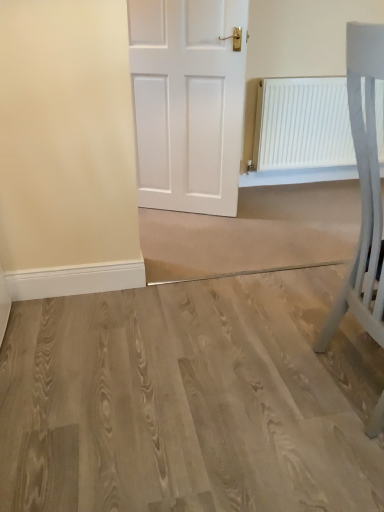
Question: Is white matte chair at right smaller than white matte radiator at upper right?

Choices:
 (A) no
 (B) yes

Answer: (A)

Question: Is white matte chair at right thinner than white matte radiator at upper right?

Choices:
 (A) yes
 (B) no

Answer: (B)

Question: Can you confirm if white matte chair at right is positioned to the left of white matte radiator at upper right?

Choices:
 (A) yes
 (B) no

Answer: (A)

Question: Can you confirm if white matte chair at right is positioned to the right of white matte radiator at upper right?

Choices:
 (A) no
 (B) yes

Answer: (A)

Question: From a real-world perspective, is white matte chair at right on top of white matte radiator at upper right?

Choices:
 (A) yes
 (B) no

Answer: (A)

Question: Is white matte radiator at upper right taller or shorter than light wood floor at center?

Choices:
 (A) short
 (B) tall

Answer: (B)

Question: In terms of size, does white matte radiator at upper right appear bigger or smaller than light wood floor at center?

Choices:
 (A) big
 (B) small

Answer: (B)

Question: Is white matte radiator at upper right inside or outside of light wood floor at center?

Choices:
 (A) inside
 (B) outside

Answer: (B)

Question: Would you say white matte radiator at upper right is to the left or to the right of light wood floor at center in the picture?

Choices:
 (A) left
 (B) right

Answer: (B)

Question: Is point (370, 74) positioned closer to the camera than point (273, 116)?

Choices:
 (A) closer
 (B) farther

Answer: (A)

Question: Is white matte chair at right spatially inside white matte radiator at upper right, or outside of it?

Choices:
 (A) outside
 (B) inside

Answer: (A)

Question: In terms of size, does white matte chair at right appear bigger or smaller than white matte radiator at upper right?

Choices:
 (A) big
 (B) small

Answer: (A)

Question: In the image, is white matte chair at right positioned in front of or behind white matte radiator at upper right?

Choices:
 (A) behind
 (B) front

Answer: (B)

Question: Would you say white matte radiator at upper right is to the left or to the right of white matte chair at right in the picture?

Choices:
 (A) right
 (B) left

Answer: (A)

Question: Considering the positions of white matte radiator at upper right and white matte chair at right in the image, is white matte radiator at upper right wider or thinner than white matte chair at right?

Choices:
 (A) wide
 (B) thin

Answer: (B)